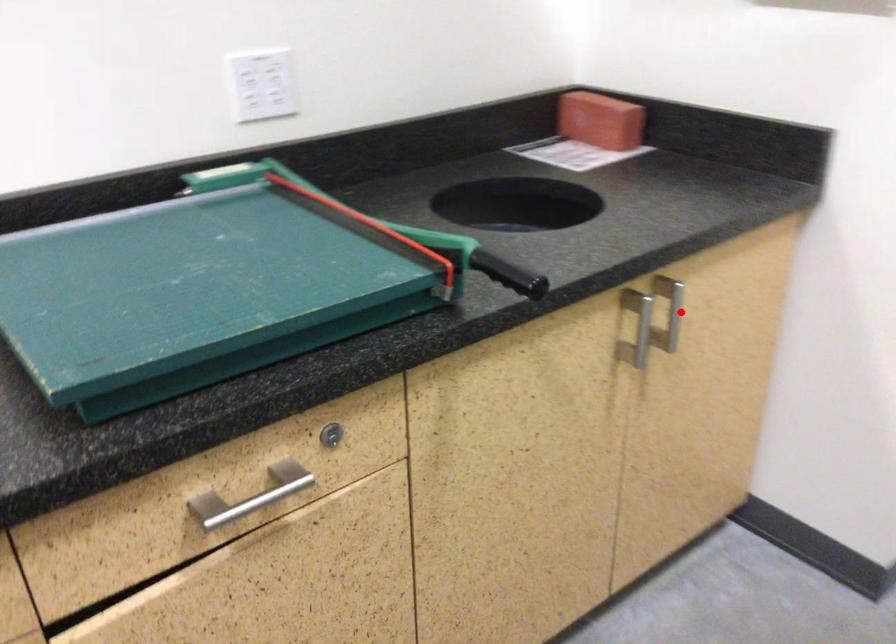
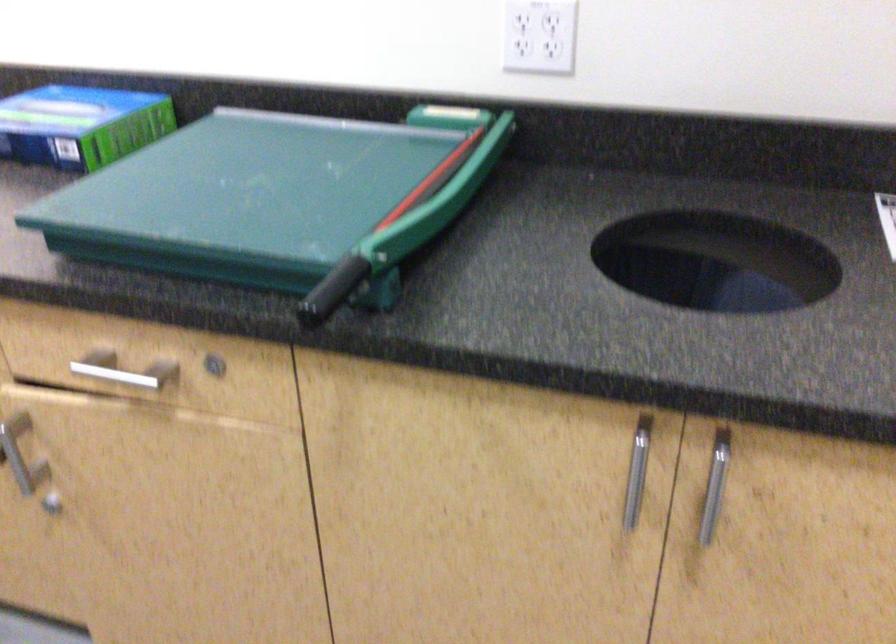
Question: A red point is marked in image1. In image2, is the corresponding 3D point closer to the camera or farther? Reply with the corresponding letter.

Choices:
 (A) The corresponding 3D point is closer.
 (B) The corresponding 3D point is farther.

Answer: (A)